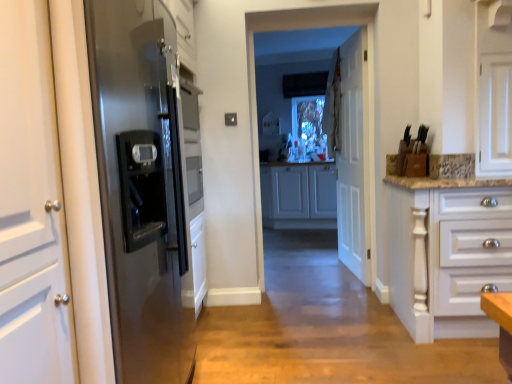
Question: From the image's perspective, is white sheer curtain at upper center positioned above or below white matte cabinet at center, which ranks as the 1th cabinetry in back-to-front order?

Choices:
 (A) below
 (B) above

Answer: (B)

Question: In the image, is white sheer curtain at upper center on the left side or the right side of white matte cabinet at center, acting as the 2th cabinetry starting from the front?

Choices:
 (A) right
 (B) left

Answer: (A)

Question: Based on their relative distances, which object is nearer to the white sheer curtain at upper center?

Choices:
 (A) clear glass window at center
 (B) white glossy drawer at right, arranged as the 2th cabinetry when viewed from the back
 (C) white wooden door at center
 (D) stainless steel refrigerator at left
 (E) white matte cabinet at center, acting as the 2th cabinetry starting from the front

Answer: (C)

Question: Which object is positioned farthest from the white matte cabinet at center, acting as the 2th cabinetry starting from the front?

Choices:
 (A) white sheer curtain at upper center
 (B) stainless steel refrigerator at left
 (C) white wooden door at center
 (D) clear glass window at center
 (E) white glossy drawer at right, arranged as the 2th cabinetry when viewed from the back

Answer: (B)